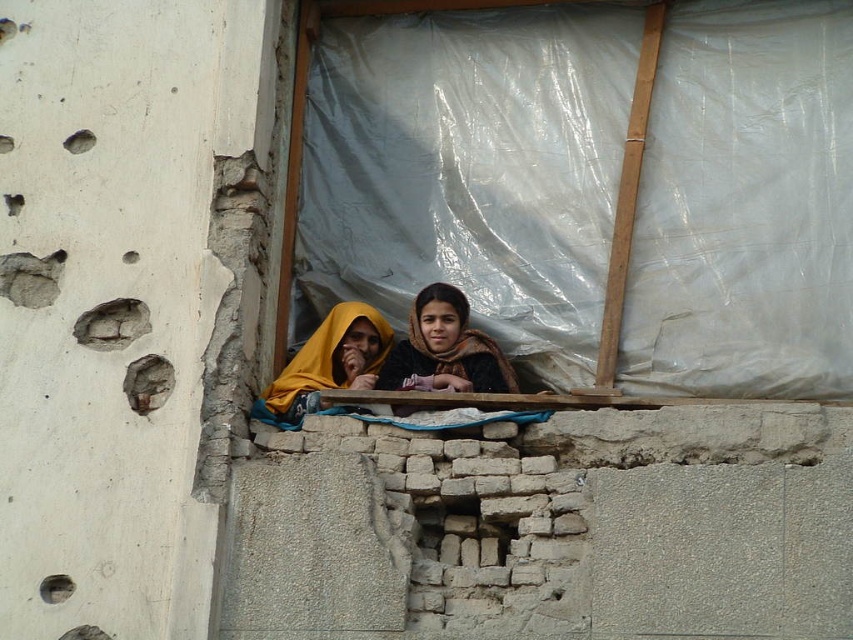
You are a photographer trying to capture a closeup of the dark brown scarf at center. What are the coordinates where you should focus your camera?

The dark brown scarf at center is located at coordinates point [445,348].

You are a photographer setting up a shot of the two individuals sitting on the platform. You notice the dark brown scarf at center and the yellow fabric at center in the scene. Which object should you focus on first if you want to capture the larger item in your frame?

The dark brown scarf at center is bigger than the yellow fabric at center, so you should focus on the dark brown scarf at center first to capture the larger item in your frame.

You are a photographer trying to capture a closeup of the dark brown scarf at center and the yellow fabric at center. Since you want to focus on both items equally, which one should you zoom in on more to ensure they appear the same size in the photo?

The dark brown scarf at center is wider than the yellow fabric at center, so you should zoom in more on the yellow fabric at center to make them appear the same size.